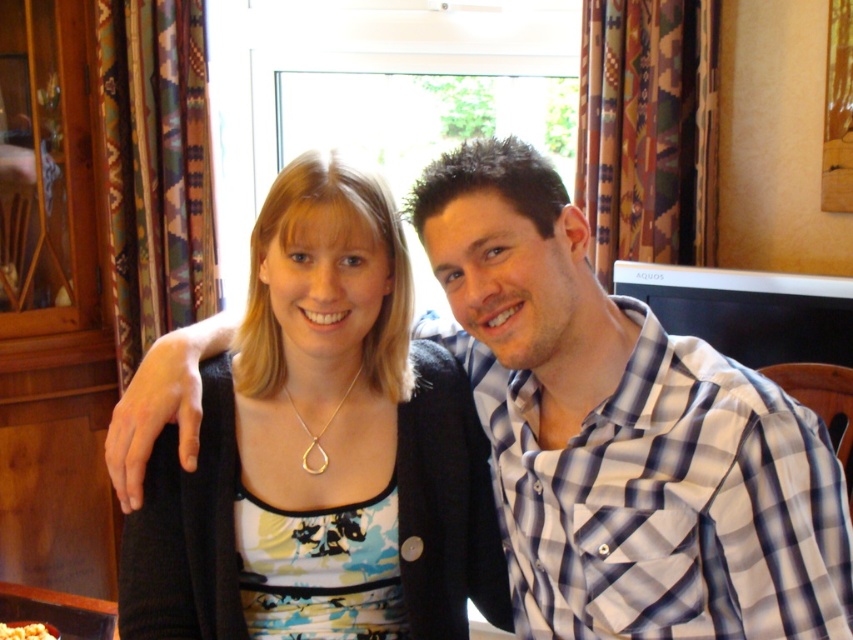
Who is shorter, matte black cardigan at center or white crumbly food at center?

white crumbly food at center

Which is in front, point (465, 588) or point (47, 628)?

Positioned in front is point (465, 588).

Where is `matte black cardigan at center`? This screenshot has height=640, width=853. matte black cardigan at center is located at coordinates (x=323, y=444).